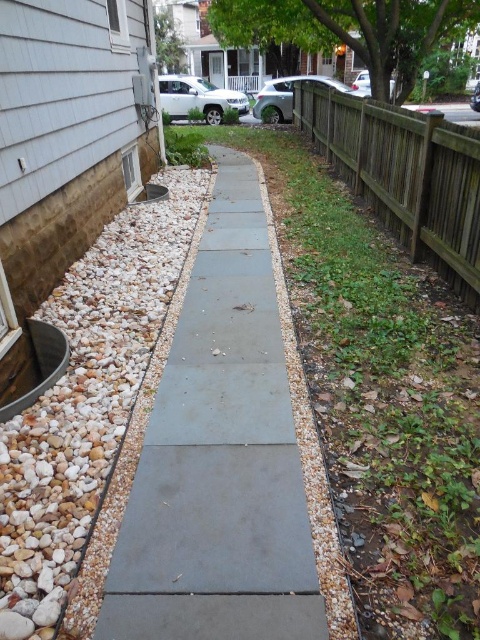
Question: Which point is closer to the camera taking this photo?

Choices:
 (A) (170, 563)
 (B) (408, 193)

Answer: (A)

Question: Does gray concrete path at center have a greater width compared to white gravel at left?

Choices:
 (A) yes
 (B) no

Answer: (B)

Question: Among these points, which one is nearest to the camera?

Choices:
 (A) (152, 332)
 (B) (164, 598)
 (C) (331, 129)

Answer: (B)

Question: Does white gravel at left appear on the left side of brown wooden fence at right?

Choices:
 (A) yes
 (B) no

Answer: (A)

Question: Which is farther from the white gravel at left?

Choices:
 (A) brown wooden fence at right
 (B) gray concrete path at center

Answer: (A)

Question: Is gray concrete path at center above brown wooden fence at right?

Choices:
 (A) no
 (B) yes

Answer: (A)